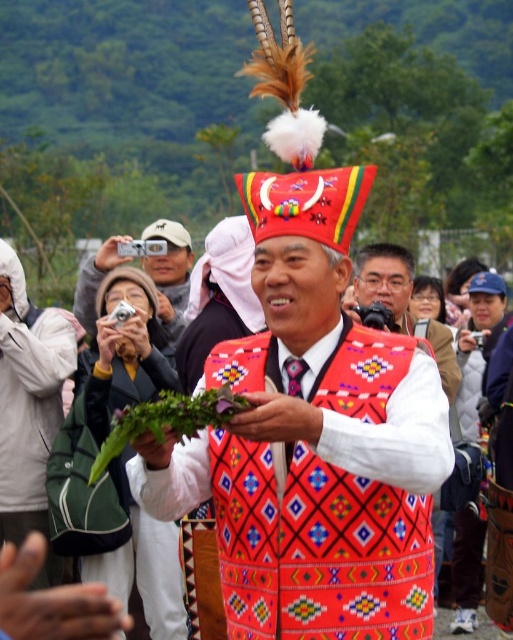
You are a photographer aiming to capture the vibrant cultural scene. You have a matte white camera at center and want to focus on the red fabric vest at center. Is the vest within the camera frame?

The red fabric vest at center is positioned under the matte white camera at center, so the vest is within the camera frame.

You are a photographer at the event and need to capture the man in the red fabric vest at center. You have a matte white camera at center. Can you fit the entire vest into your camera frame without zooming out?

The red fabric vest at center is thinner than the matte white camera at center, so yes, the entire vest can fit into the camera frame without needing to zoom out.

You are standing at a distance of 50 feet from the man in the center of the frame. You want to approach him to take a photo. The point marked as point (442, 392) is located on his hat. Is the point on his hat closer to you than the man himself?

The distance of point (442, 392) from viewer is 60.73 feet, so the point on his hat is farther away than the man himself since you are 50 feet away from him. Therefore, the point on his hat is not closer to you than the man.